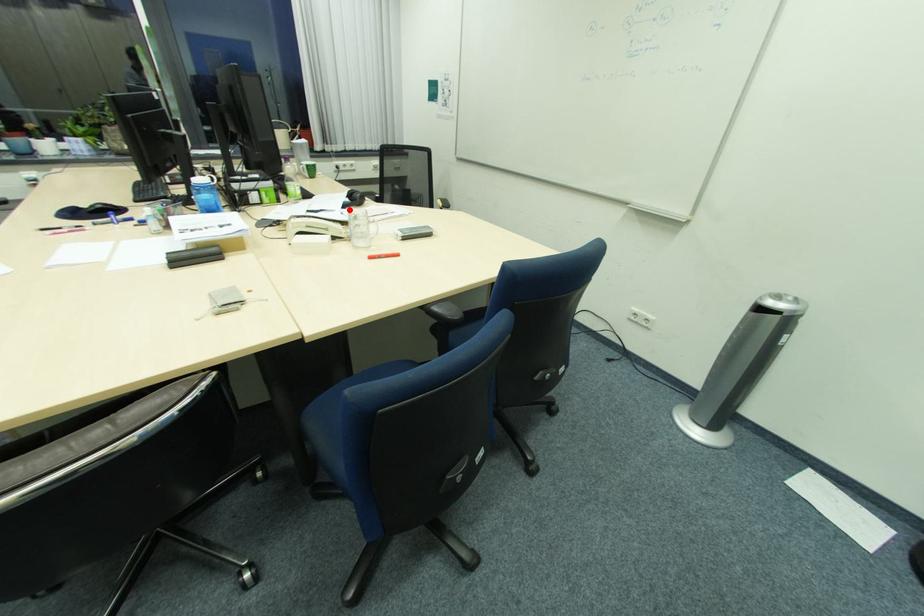
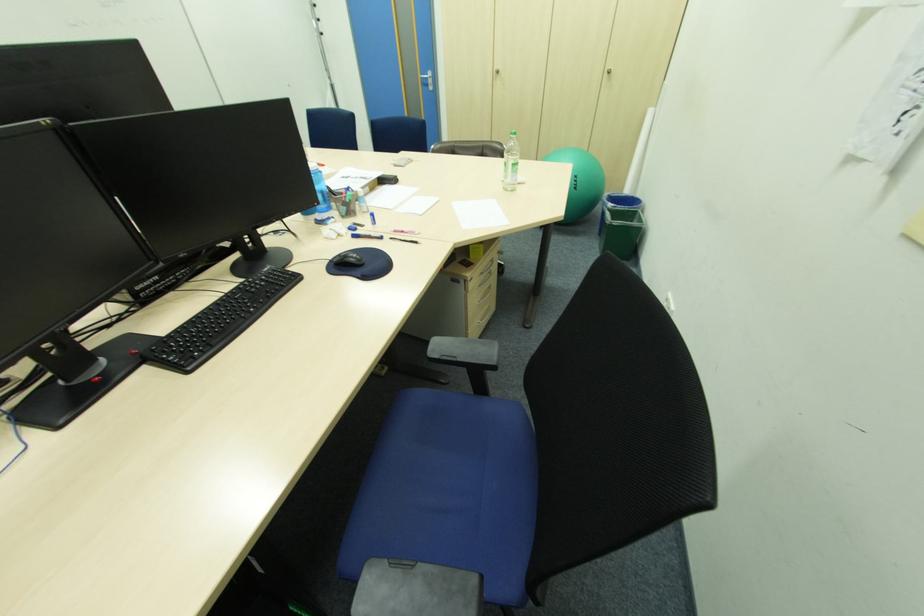
Question: I am providing you with two images of the same scene from different viewpoints. A red point is marked on the first image. Is the red point's position out of view in image 2?

Choices:
 (A) Yes
 (B) No

Answer: (A)